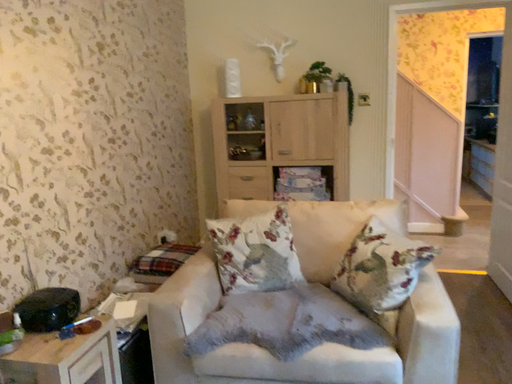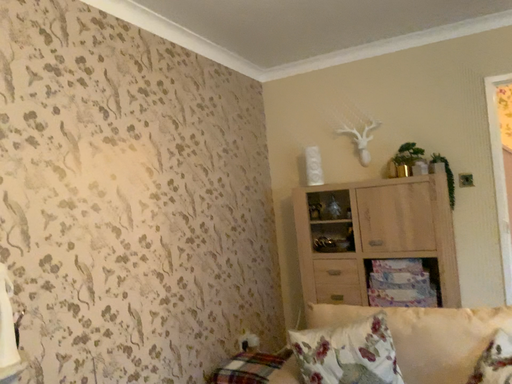
Question: How did the camera likely rotate when shooting the video?

Choices:
 (A) rotated right
 (B) rotated left

Answer: (B)